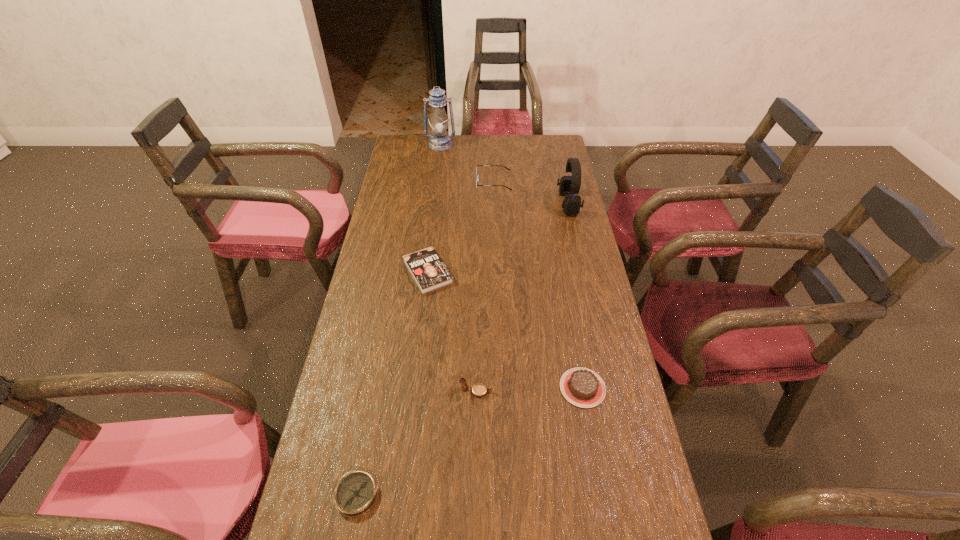
Image resolution: width=960 pixels, height=540 pixels. What are the coordinates of `free point between the farthest object and the spectacles` in the screenshot? It's located at (468, 164).

Locate an element on the screen. Image resolution: width=960 pixels, height=540 pixels. blank region between the lantern and the second tallest object is located at coordinates (505, 174).

You are a GUI agent. You are given a task and a screenshot of the screen. Output one action in this format:
    pyautogui.click(x=<x>, y=<y>)
    Task: Click on the vacant space that's between the sixth shortest object and the taller compass
    Image resolution: width=960 pixels, height=540 pixels.
    Given the screenshot: What is the action you would take?
    pyautogui.click(x=522, y=298)

Find the location of `object that ranks as the fifth closest to the second shortest object`. object that ranks as the fifth closest to the second shortest object is located at coordinates point(356,492).

Where is `object that can be found as the sixth closest to the spectacles`? object that can be found as the sixth closest to the spectacles is located at coordinates (356, 492).

Image resolution: width=960 pixels, height=540 pixels. I want to click on free space that satisfies the following two spatial constraints: 1. on the front-facing side of the second shortest object; 2. on the right side of the tallest object, so click(425, 272).

Locate an element on the screen. vacant point that satisfies the following two spatial constraints: 1. on the lenses of the spectacles; 2. on the right side of the third shortest object is located at coordinates (501, 388).

Image resolution: width=960 pixels, height=540 pixels. I want to click on free space that satisfies the following two spatial constraints: 1. on the front side of the fourth farthest object; 2. on the left side of the third shortest object, so click(x=415, y=388).

The width and height of the screenshot is (960, 540). I want to click on free space in the image that satisfies the following two spatial constraints: 1. on the headband of the headset; 2. on the front side of the shorter compass, so click(636, 494).